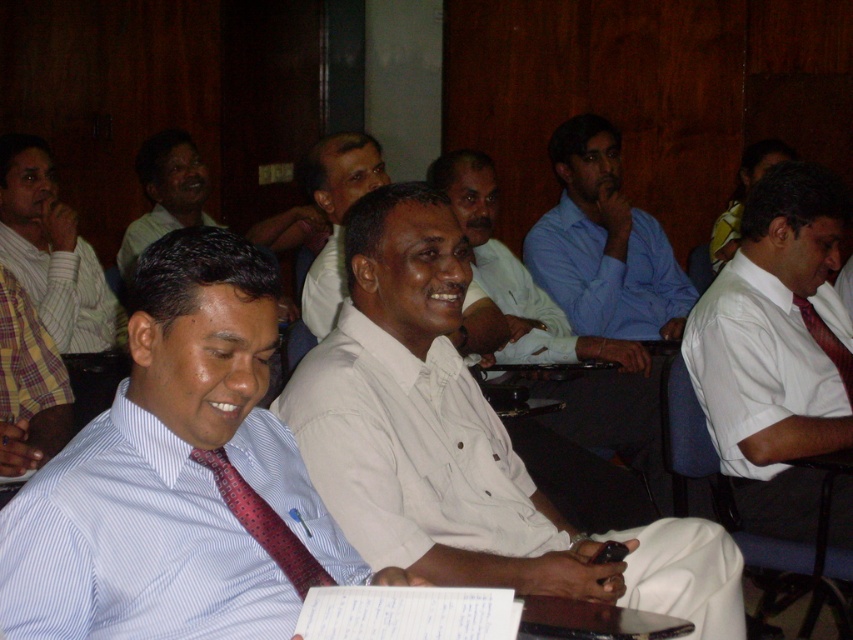
Question: Can you confirm if white striped shirt at center is positioned to the left of blue fabric chair at right?

Choices:
 (A) no
 (B) yes

Answer: (B)

Question: Does white cotton shirt at center have a smaller size compared to red silk tie at right?

Choices:
 (A) no
 (B) yes

Answer: (A)

Question: Is striped cotton shirt at left to the right of red silk tie at right from the viewer's perspective?

Choices:
 (A) yes
 (B) no

Answer: (B)

Question: Based on their relative distances, which object is farther from the white matte shirt at center?

Choices:
 (A) red silk tie at right
 (B) white shirt at center

Answer: (A)

Question: Which point is farther to the camera?

Choices:
 (A) white shirt at center
 (B) striped cotton shirt at left

Answer: (B)

Question: Among these points, which one is nearest to the camera?

Choices:
 (A) (236, 435)
 (B) (311, 556)
 (C) (612, 348)
 (D) (807, 305)

Answer: (B)